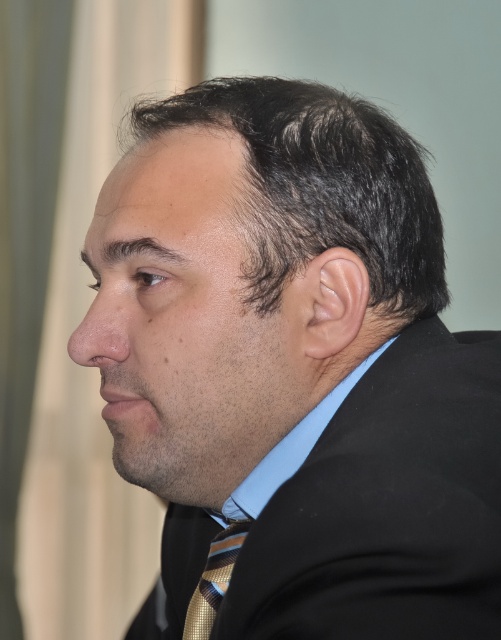
Based on the scene description, which object is positioned higher when looking at the man from the front? The dark brown hair at center or the smooth skin ear at center?

The dark brown hair at center is positioned higher than the smooth skin ear at center.

You are a photographer taking a portrait of the man. You need to ensure both the smooth skin ear at center and the striped silk tie at center are clearly visible. Which object should you focus on to ensure it is in sharp focus first?

The striped silk tie at center is larger than the smooth skin ear at center, so focusing on the striped silk tie at center first would help ensure both are in sharp focus since it occupies more space in the frame.

Based on the scene description, which object is shorter between the smooth skin ear at center and the smooth skin nose at center?

The smooth skin ear at center is shorter than the smooth skin nose at center.